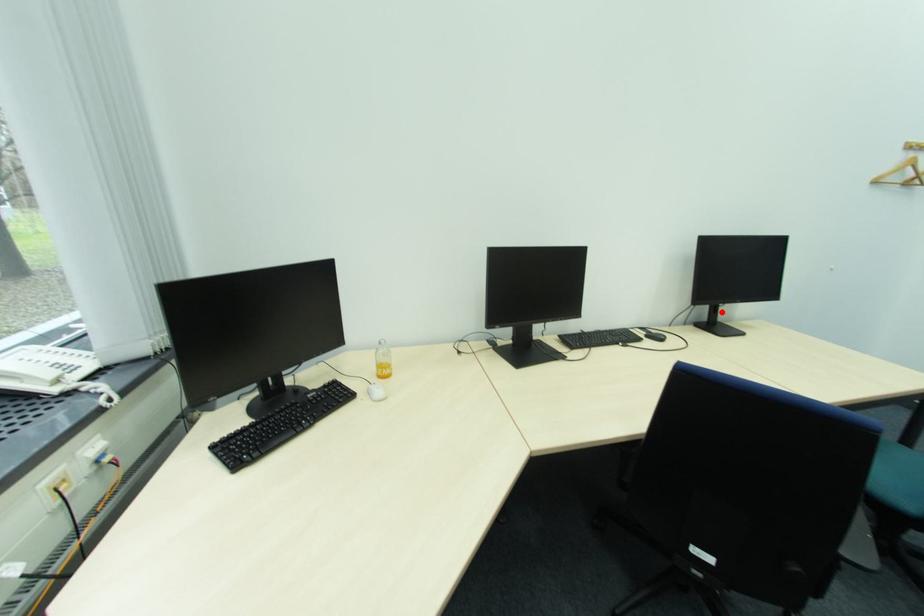
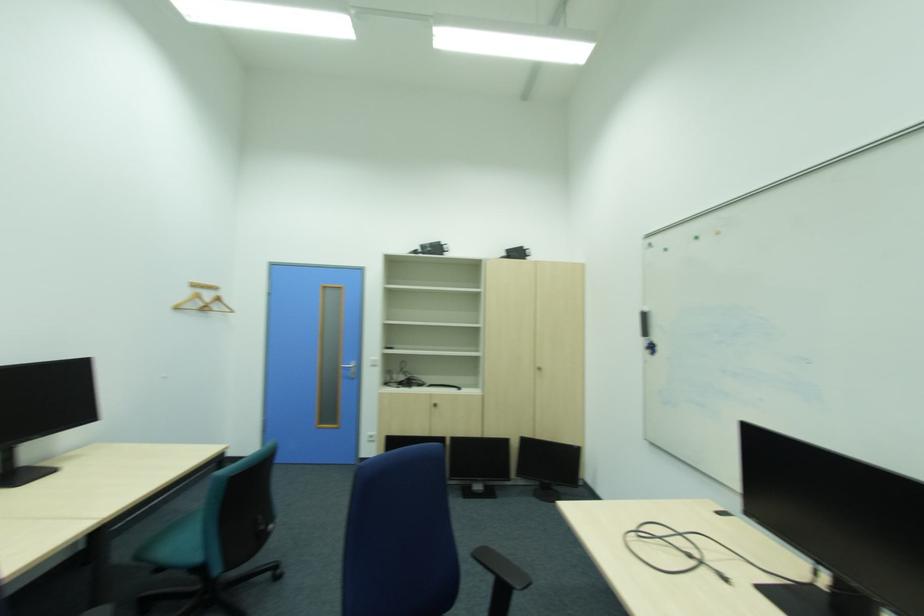
The point at the highlighted location is marked in the first image. Where is the corresponding point in the second image?

(13, 459)